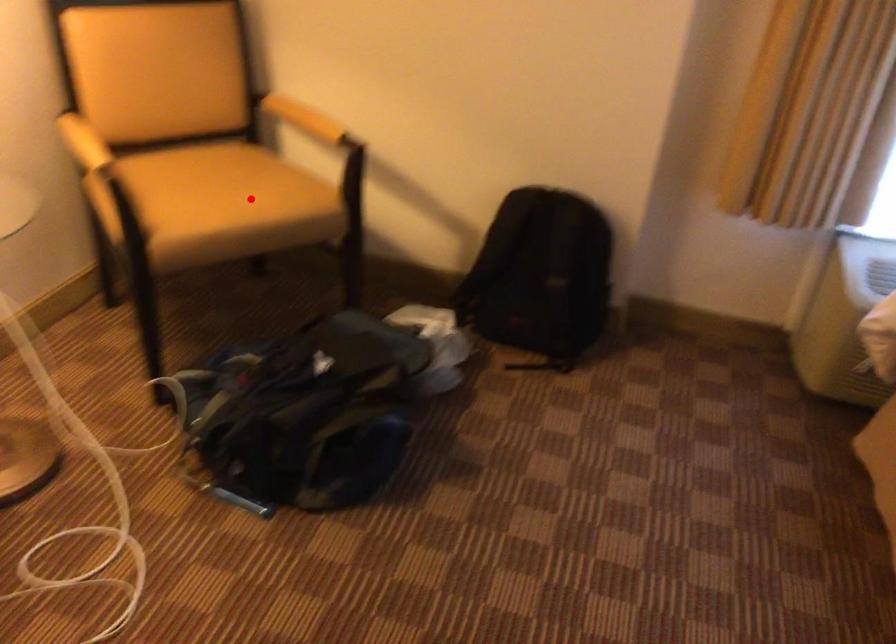
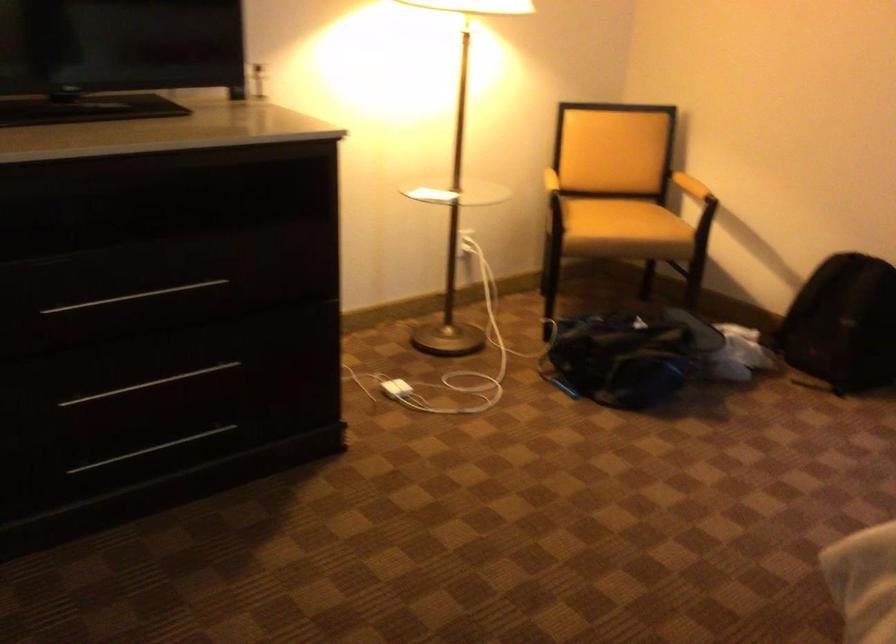
Where in the second image is the point corresponding to the highlighted location from the first image?

(623, 220)